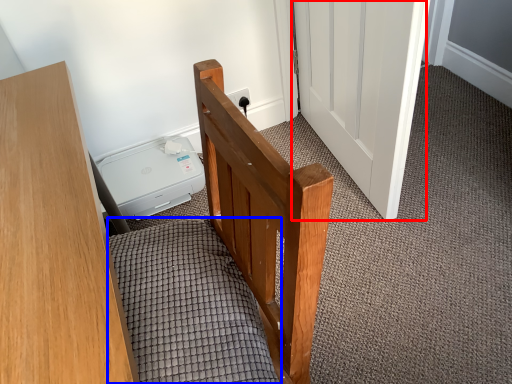
Question: Which object is further to the camera taking this photo, door (highlighted by a red box) or bedding (highlighted by a blue box)?

Choices:
 (A) door
 (B) bedding

Answer: (A)